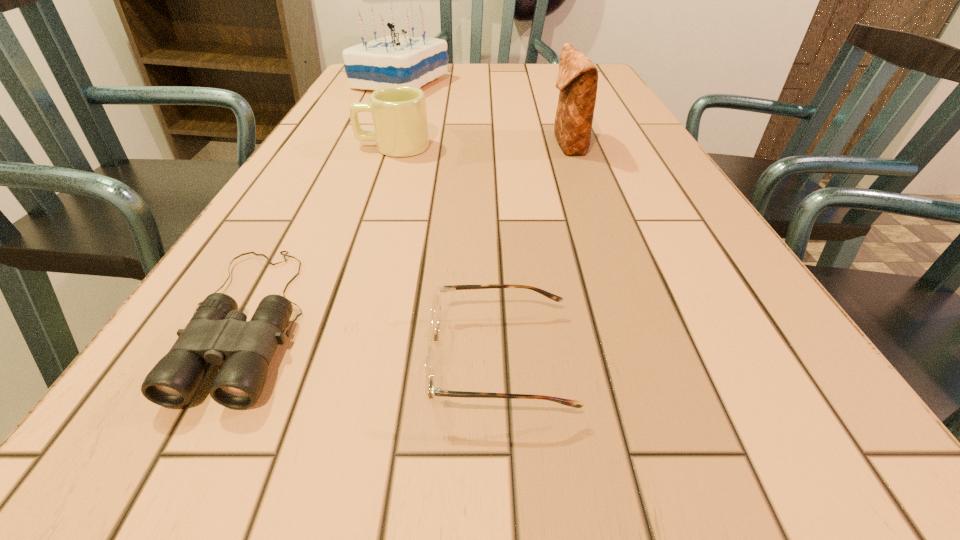
Find the location of `unoccupied area between the birthday cake and the clutch bag`. unoccupied area between the birthday cake and the clutch bag is located at coordinates (484, 114).

Where is `unoccupied area between the binoculars and the farthest object`? This screenshot has width=960, height=540. unoccupied area between the binoculars and the farthest object is located at coordinates (325, 201).

At what (x,y) coordinates should I click in order to perform the action: click on unoccupied area between the clutch bag and the second object from right to left. Please return your answer as a coordinate pair (x, y). The height and width of the screenshot is (540, 960). Looking at the image, I should click on (534, 252).

I want to click on vacant area between the mug and the binoculars, so click(322, 233).

Locate an element on the screen. The image size is (960, 540). free space between the farthest object and the clutch bag is located at coordinates (484, 114).

Where is `the second closest object to the birthday cake`? This screenshot has width=960, height=540. the second closest object to the birthday cake is located at coordinates (577, 80).

This screenshot has width=960, height=540. In order to click on the third closest object to the birthday cake in this screenshot , I will do `click(217, 333)`.